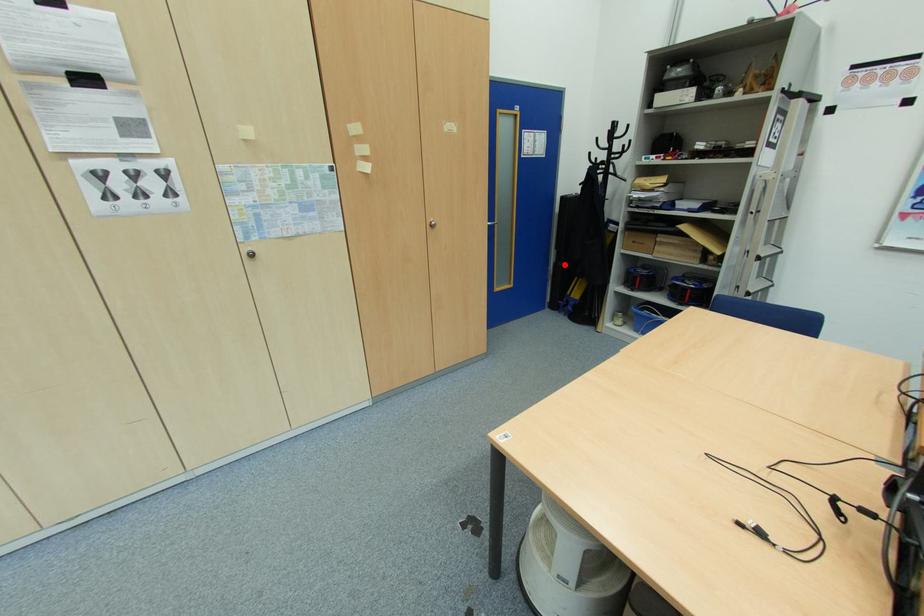
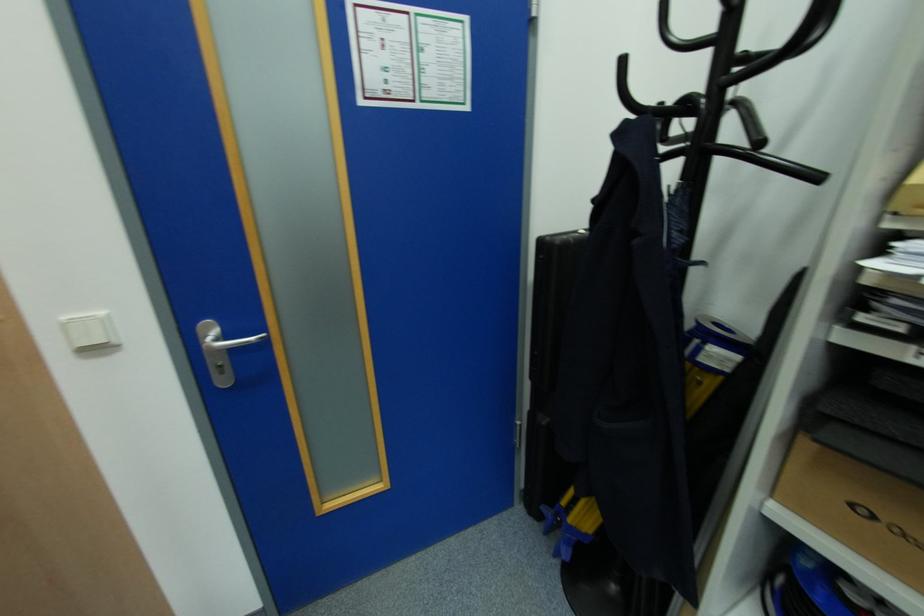
Find the pixel in the second image that matches the highlighted location in the first image.

(548, 421)